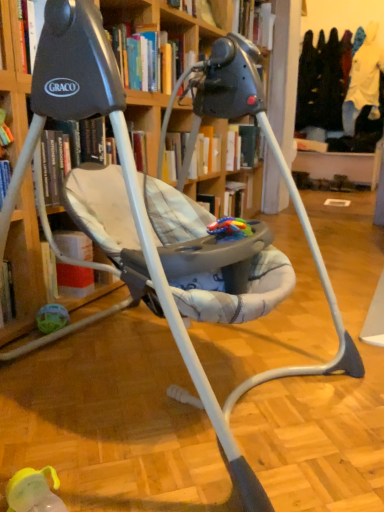
Question: From a real-world perspective, is hardcover book at upper center, the 2th book when ordered from top to bottom, below hardcover book at upper center, the first book viewed from the back?

Choices:
 (A) yes
 (B) no

Answer: (A)

Question: Does hardcover book at upper center, which ranks as the second book in bottom-to-top order, have a lesser height compared to hardcover book at upper center, the first book viewed from the back?

Choices:
 (A) no
 (B) yes

Answer: (B)

Question: Does hardcover book at upper center, which ranks as the second book in left-to-right order, appear on the left side of hardcover book at upper center, arranged as the 3th book when viewed from the front?

Choices:
 (A) no
 (B) yes

Answer: (B)

Question: Is hardcover book at upper center, which ranks as the second book in left-to-right order, not within hardcover book at upper center, which is the first book in top-to-bottom order?

Choices:
 (A) no
 (B) yes

Answer: (B)

Question: Could you tell me if hardcover book at upper center, which ranks as the second book in bottom-to-top order, is turned towards hardcover book at upper center, positioned as the third book in bottom-to-top order?

Choices:
 (A) yes
 (B) no

Answer: (B)

Question: Would you say hardcover book at upper center, the first book viewed from the back, is part of hardcover book at upper center, which appears as the 2th book when viewed from the back,'s contents?

Choices:
 (A) yes
 (B) no

Answer: (B)

Question: From a real-world perspective, is hardcover book at upper center, which appears as the 3th book when viewed from the back, physically below hardcover book at upper center, arranged as the 3th book when viewed from the front?

Choices:
 (A) no
 (B) yes

Answer: (B)

Question: Considering the relative sizes of hardcover book at upper center, which ranks as the 3th book in top-to-bottom order, and hardcover book at upper center, which is the third book in left-to-right order, in the image provided, is hardcover book at upper center, which ranks as the 3th book in top-to-bottom order, wider than hardcover book at upper center, which is the third book in left-to-right order,?

Choices:
 (A) yes
 (B) no

Answer: (A)

Question: Is hardcover book at upper center, which ranks as the 3th book in right-to-left order, not close to hardcover book at upper center, arranged as the 3th book when viewed from the front?

Choices:
 (A) no
 (B) yes

Answer: (B)

Question: Can you confirm if hardcover book at upper center, marked as the 1th book in a bottom-to-top arrangement, is smaller than hardcover book at upper center, which is the first book in top-to-bottom order?

Choices:
 (A) yes
 (B) no

Answer: (B)

Question: Can you confirm if hardcover book at upper center, the first book from the front, is positioned to the left of hardcover book at upper center, which is the first book in top-to-bottom order?

Choices:
 (A) yes
 (B) no

Answer: (A)

Question: Is hardcover book at upper center, which ranks as the 3th book in top-to-bottom order, thinner than hardcover book at upper center, arranged as the 3th book when viewed from the front?

Choices:
 (A) no
 (B) yes

Answer: (A)

Question: Can we say hardcover book at upper center, positioned as the third book in bottom-to-top order, lies outside hardcover book at upper center, marked as the first book in a left-to-right arrangement?

Choices:
 (A) yes
 (B) no

Answer: (A)